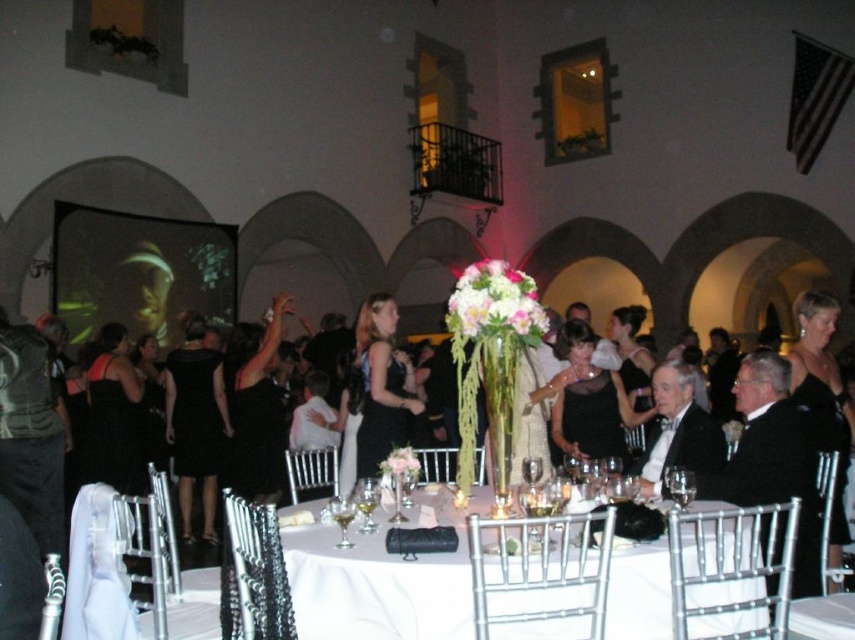
Question: Can you confirm if black satin dress at center is positioned to the right of white silk bouquet at center?

Choices:
 (A) no
 (B) yes

Answer: (A)

Question: Estimate the real-world distances between objects in this image. Which object is farther from the white cloth table at center?

Choices:
 (A) black satin dress at center
 (B) clear glass wine glass at center

Answer: (A)

Question: Can you confirm if white cloth table at center is positioned below black satin dress at center?

Choices:
 (A) yes
 (B) no

Answer: (A)

Question: Among these points, which one is farthest from the camera?

Choices:
 (A) (502, 276)
 (B) (396, 385)
 (C) (380, 465)
 (D) (640, 609)

Answer: (B)

Question: Is black satin dress at center above pale pink silk flower at center?

Choices:
 (A) no
 (B) yes

Answer: (B)

Question: Among these objects, which one is nearest to the camera?

Choices:
 (A) clear glass wine glass at center
 (B) white silk bouquet at center

Answer: (A)